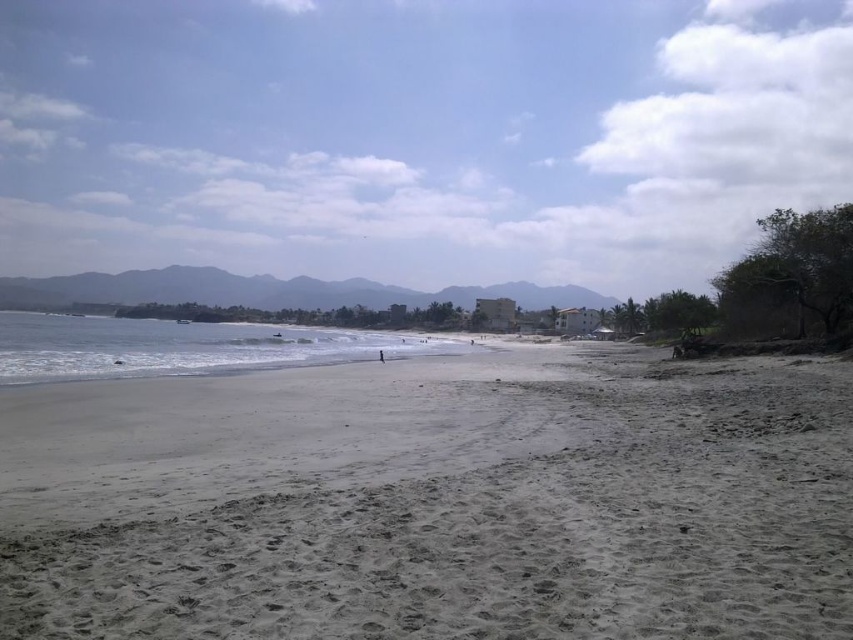
Question: Which point appears closest to the camera in this image?

Choices:
 (A) [x=173, y=404]
 (B) [x=381, y=349]

Answer: (A)

Question: Does gray sand at center come behind skinny person at center?

Choices:
 (A) no
 (B) yes

Answer: (A)

Question: Estimate the real-world distances between objects in this image. Which object is farther from the skinny person at center?

Choices:
 (A) gray sand at center
 (B) white sand at lower left

Answer: (B)

Question: Which of the following is the farthest from the observer?

Choices:
 (A) (44, 400)
 (B) (379, 352)

Answer: (B)

Question: Can you confirm if white sand at lower left is bigger than skinny person at center?

Choices:
 (A) no
 (B) yes

Answer: (B)

Question: Does gray sand at center have a smaller size compared to skinny person at center?

Choices:
 (A) yes
 (B) no

Answer: (B)